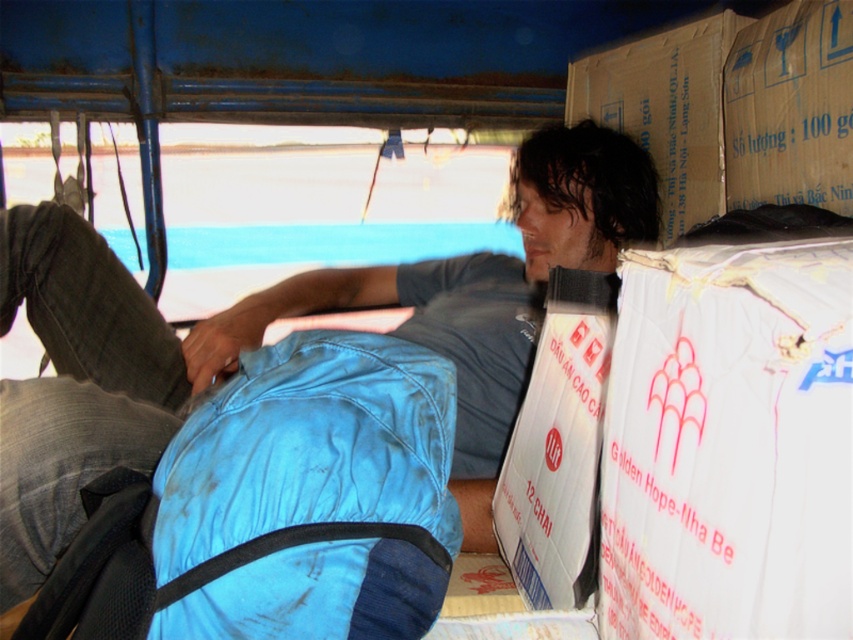
You are organizing the items in the vehicle. You need to place the blue fabric sleeping bag at lower center and the cardboard box at upper right. Which item requires more space to store?

The blue fabric sleeping bag at lower center requires more space to store because it is bigger than the cardboard box at upper right.

You are organizing the items in the vehicle and need to place the blue fabric sleeping bag at lower center and the cardboard box at upper right. Which object is wider?

The blue fabric sleeping bag at lower center is wider than the cardboard box at upper right.

You are inside a small vehicle used for transporting goods. There is a person lying down near a blue backpack secured with a black strap. You need to place a new item at the point specified by coordinates point (729, 444). What object will this point be located on?

The point (729, 444) is located on the white cardboard box at right.